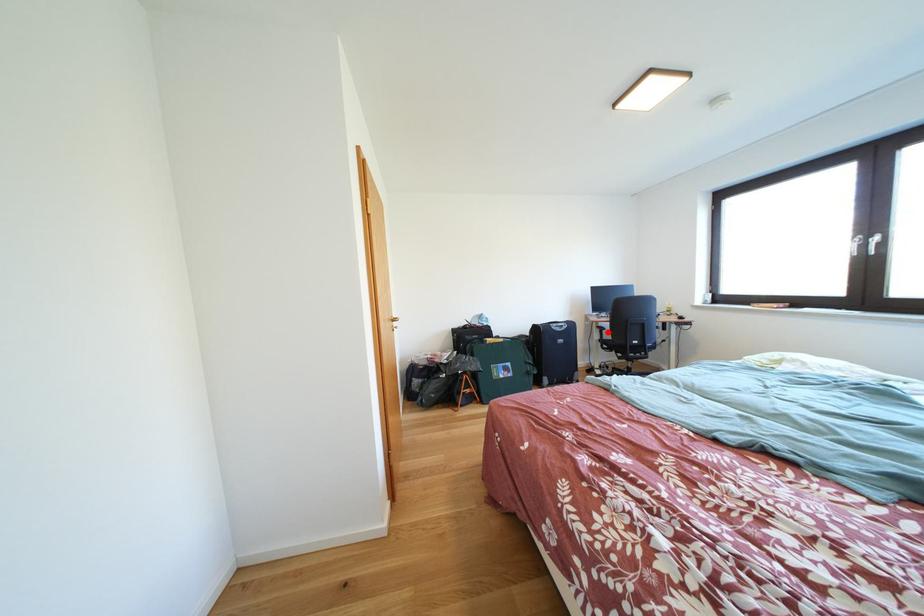
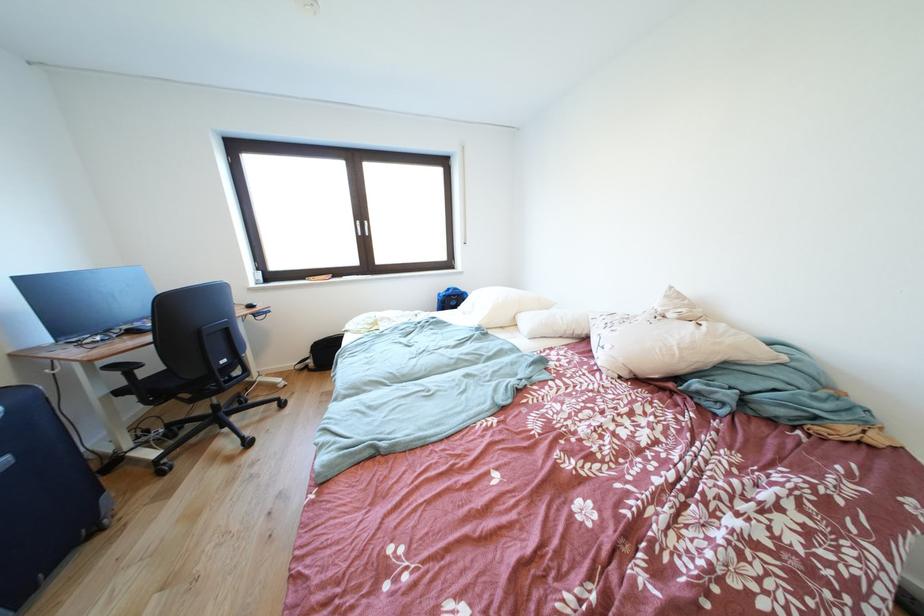
Locate, in the second image, the point that corresponds to the highlighted location in the first image.

(120, 371)